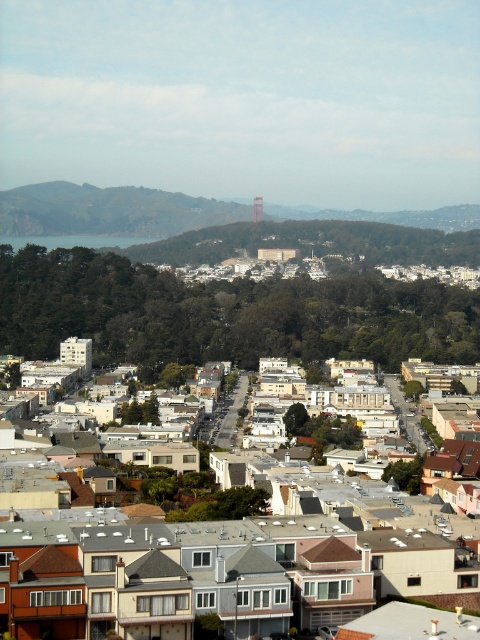
Question: Which point is farther to the camera?

Choices:
 (A) orange metallic bridge at center
 (B) white matte houses at center

Answer: (A)

Question: Is white matte houses at center closer to the viewer compared to orange metallic bridge at center?

Choices:
 (A) yes
 (B) no

Answer: (A)

Question: In this image, where is white matte houses at center located relative to orange metallic bridge at center?

Choices:
 (A) left
 (B) right

Answer: (A)

Question: Which of the following is the closest to the observer?

Choices:
 (A) orange metallic bridge at center
 (B) white matte houses at center

Answer: (B)

Question: Does white matte houses at center have a greater width compared to orange metallic bridge at center?

Choices:
 (A) no
 (B) yes

Answer: (B)

Question: Which of the following is the closest to the observer?

Choices:
 (A) (261, 196)
 (B) (196, 572)

Answer: (B)